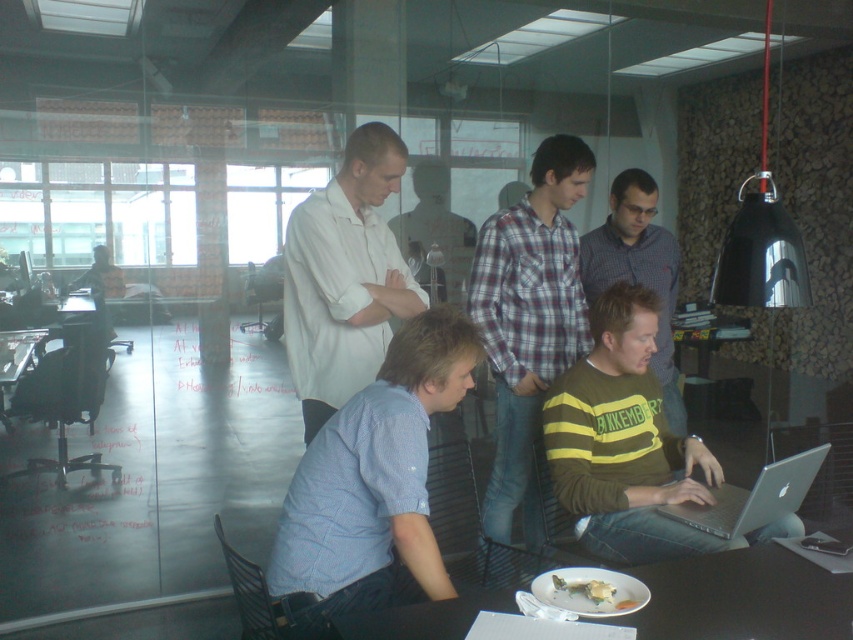
Who is more distant from viewer, (315, 588) or (614, 230)?

The point (614, 230) is behind.

Is blue checkered shirt at center above green striped shirt at center?

No.

This screenshot has width=853, height=640. What are the coordinates of `blue checkered shirt at center` in the screenshot? It's located at (372, 484).

Which is in front, point (668, 301) or point (7, 424)?

Point (7, 424) is in front.

Does green striped shirt at center have a larger size compared to black plastic table at lower left?

Yes.

Identify the location of green striped shirt at center. (637, 269).

This screenshot has width=853, height=640. Find the location of `green striped shirt at center`. green striped shirt at center is located at coordinates (637, 269).

Does blue checkered shirt at center have a greater height compared to white paper plate at lower center?

Correct, blue checkered shirt at center is much taller as white paper plate at lower center.

Does point (289, 589) come closer to viewer compared to point (585, 580)?

No, (289, 589) is further to viewer.

This screenshot has height=640, width=853. What are the coordinates of `blue checkered shirt at center` in the screenshot? It's located at (372, 484).